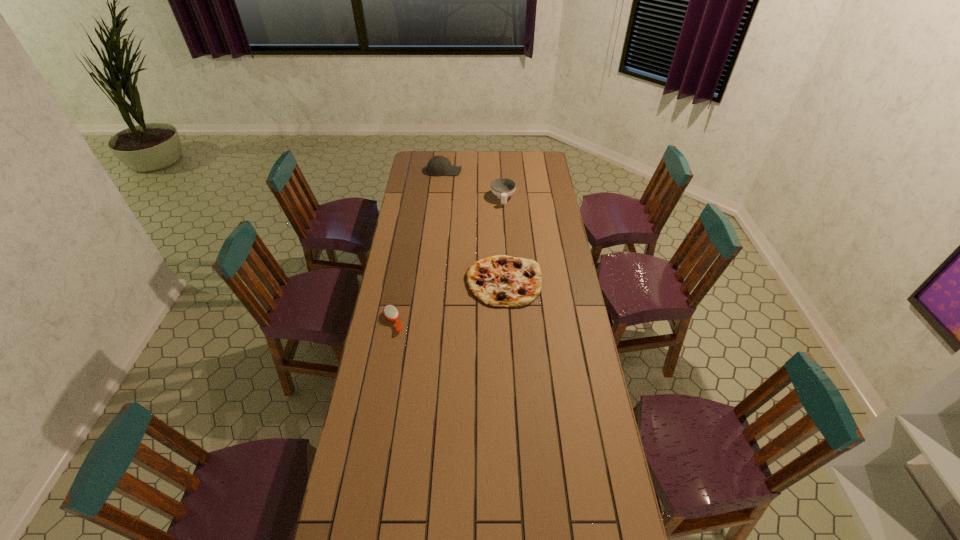
At what (x,y) coordinates should I click in order to perform the action: click on the farthest object. Please return your answer as a coordinate pair (x, y). Looking at the image, I should click on (438, 165).

Find the location of a particular element. The height and width of the screenshot is (540, 960). baseball cap is located at coordinates (438, 165).

Identify the location of the second farthest object. (503, 188).

Identify the location of the second tallest object. The image size is (960, 540). (x=503, y=188).

Image resolution: width=960 pixels, height=540 pixels. I want to click on the nearest object, so click(x=390, y=312).

Find the location of a particular element. Image resolution: width=960 pixels, height=540 pixels. pizza is located at coordinates (500, 281).

This screenshot has width=960, height=540. I want to click on vacant area situated 0.200m on the front brim of the baseball cap, so click(495, 171).

The width and height of the screenshot is (960, 540). I want to click on vacant space located on the side with the handle of the chinaware, so click(x=504, y=217).

Find the location of a particular element. This screenshot has width=960, height=540. vacant region located on the right of the nearest object is located at coordinates (489, 321).

The width and height of the screenshot is (960, 540). I want to click on free space located 0.160m on the front of the second nearest object, so click(507, 339).